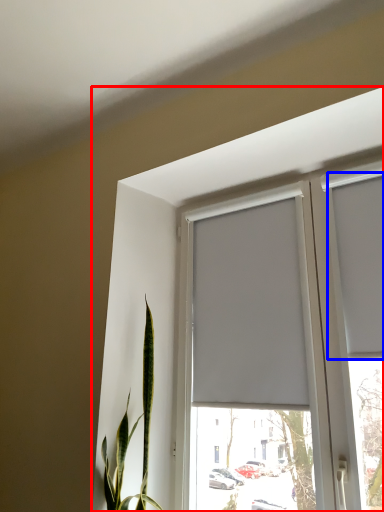
Question: Among these objects, which one is nearest to the camera, window (highlighted by a red box) or curtain (highlighted by a blue box)?

Choices:
 (A) window
 (B) curtain

Answer: (A)